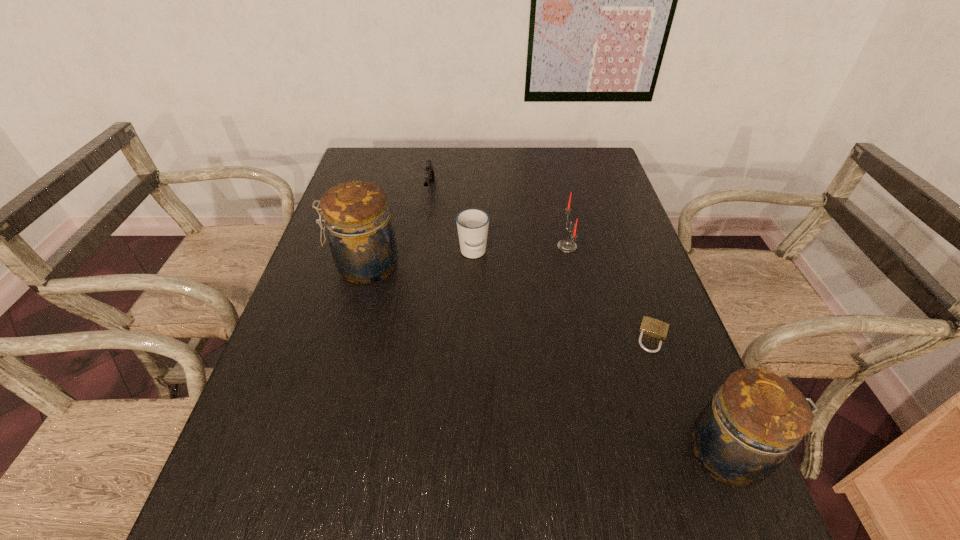
Locate an element on the screen. The width and height of the screenshot is (960, 540). spot to insert another jar for uniform distribution is located at coordinates (514, 343).